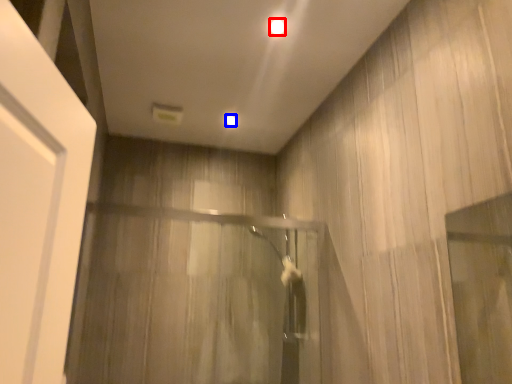
Question: Which of the following is the farthest to the observer, lighting (highlighted by a red box) or lighting (highlighted by a blue box)?

Choices:
 (A) lighting
 (B) lighting

Answer: (B)